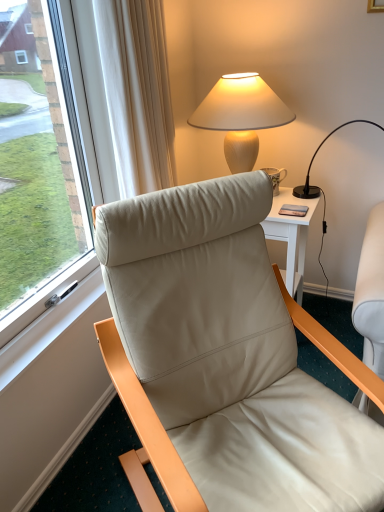
Question: Should I look upward or downward to see matte black phone at upper right?

Choices:
 (A) down
 (B) up

Answer: (B)

Question: Does black glass lamp at upper right, arranged as the 2th lamp when viewed from the left, touch matte beige lampshade at upper right, the 1th lamp viewed from the left?

Choices:
 (A) yes
 (B) no

Answer: (B)

Question: Is black glass lamp at upper right, which is the first lamp in right-to-left order, at the left side of matte beige lampshade at upper right, the 1th lamp viewed from the left?

Choices:
 (A) no
 (B) yes

Answer: (A)

Question: From the image's perspective, is black glass lamp at upper right, arranged as the 2th lamp when viewed from the left, located above matte beige lampshade at upper right, the 1th lamp viewed from the left?

Choices:
 (A) yes
 (B) no

Answer: (B)

Question: Does black glass lamp at upper right, which is the first lamp in right-to-left order, have a smaller size compared to matte beige lampshade at upper right, the 1th lamp viewed from the left?

Choices:
 (A) yes
 (B) no

Answer: (A)

Question: Is matte beige lampshade at upper right, the 1th lamp viewed from the left, a part of black glass lamp at upper right, arranged as the 2th lamp when viewed from the left?

Choices:
 (A) yes
 (B) no

Answer: (B)

Question: Considering the relative sizes of black glass lamp at upper right, which is the first lamp in right-to-left order, and matte beige lampshade at upper right, the 1th lamp viewed from the left, in the image provided, is black glass lamp at upper right, which is the first lamp in right-to-left order, bigger than matte beige lampshade at upper right, the 1th lamp viewed from the left,?

Choices:
 (A) yes
 (B) no

Answer: (B)

Question: Is matte black phone at upper right to the left of black glass lamp at upper right, arranged as the 2th lamp when viewed from the left, from the viewer's perspective?

Choices:
 (A) no
 (B) yes

Answer: (B)

Question: Is matte black phone at upper right further to the viewer compared to black glass lamp at upper right, arranged as the 2th lamp when viewed from the left?

Choices:
 (A) no
 (B) yes

Answer: (B)

Question: Is matte black phone at upper right completely or partially outside of black glass lamp at upper right, arranged as the 2th lamp when viewed from the left?

Choices:
 (A) no
 (B) yes

Answer: (B)

Question: Does matte black phone at upper right have a greater width compared to black glass lamp at upper right, which is the first lamp in right-to-left order?

Choices:
 (A) yes
 (B) no

Answer: (B)

Question: From a real-world perspective, is matte black phone at upper right positioned under black glass lamp at upper right, which is the first lamp in right-to-left order, based on gravity?

Choices:
 (A) no
 (B) yes

Answer: (B)

Question: Considering the relative sizes of matte black phone at upper right and black glass lamp at upper right, arranged as the 2th lamp when viewed from the left, in the image provided, is matte black phone at upper right smaller than black glass lamp at upper right, arranged as the 2th lamp when viewed from the left,?

Choices:
 (A) no
 (B) yes

Answer: (B)

Question: Considering the relative sizes of leather at left and black glass lamp at upper right, which is the first lamp in right-to-left order, in the image provided, is leather at left shorter than black glass lamp at upper right, which is the first lamp in right-to-left order,?

Choices:
 (A) no
 (B) yes

Answer: (A)